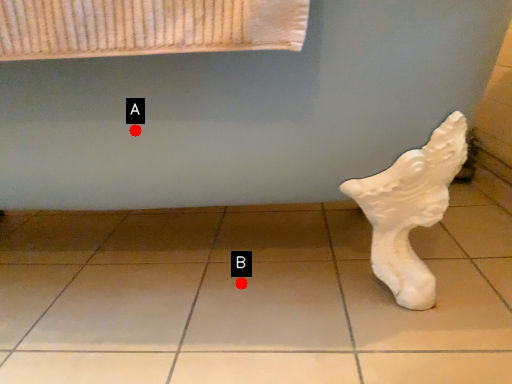
Question: Two points are circled on the image, labeled by A and B beside each circle. Among these points, which one is nearest to the camera?

Choices:
 (A) A is closer
 (B) B is closer

Answer: (A)